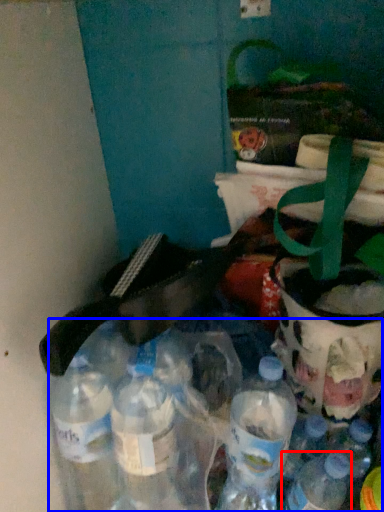
Question: Among these objects, which one is farthest to the camera, bottle (highlighted by a red box) or bottle (highlighted by a blue box)?

Choices:
 (A) bottle
 (B) bottle

Answer: (A)